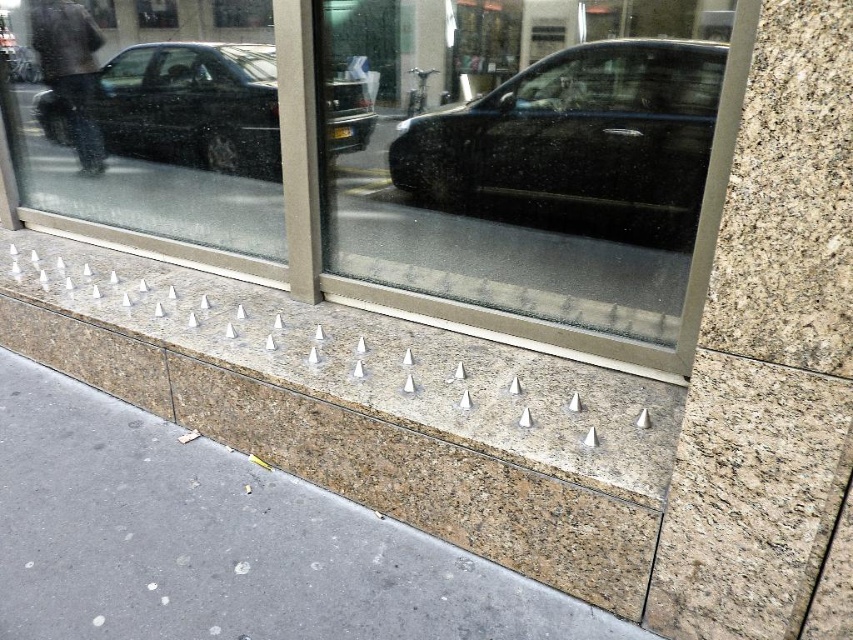
Between silver metallic spikes at center and black glossy car at center, which one is positioned lower?

silver metallic spikes at center is lower down.

Is silver metallic spikes at center to the left of black glossy car at center from the viewer's perspective?

Yes, silver metallic spikes at center is to the left of black glossy car at center.

What do you see at coordinates (221, 541) in the screenshot?
I see `silver metallic spikes at center` at bounding box center [221, 541].

The width and height of the screenshot is (853, 640). I want to click on silver metallic spikes at center, so click(221, 541).

Does transparent glass shop window at center appear on the left side of shiny black car at upper left?

Incorrect, transparent glass shop window at center is not on the left side of shiny black car at upper left.

Which of these two, transparent glass shop window at center or shiny black car at upper left, stands shorter?

Standing shorter between the two is shiny black car at upper left.

Between point (149, 49) and point (141, 61), which one is positioned behind?

Point (141, 61)

This screenshot has height=640, width=853. Identify the location of transparent glass shop window at center. (399, 150).

Between point (701, 224) and point (643, 138), which one is positioned in front?

Positioned in front is point (701, 224).

Can you confirm if transparent glass shop window at center is positioned below black glossy car at center?

No, transparent glass shop window at center is not below black glossy car at center.

Identify the location of transparent glass shop window at center. This screenshot has width=853, height=640. (399, 150).